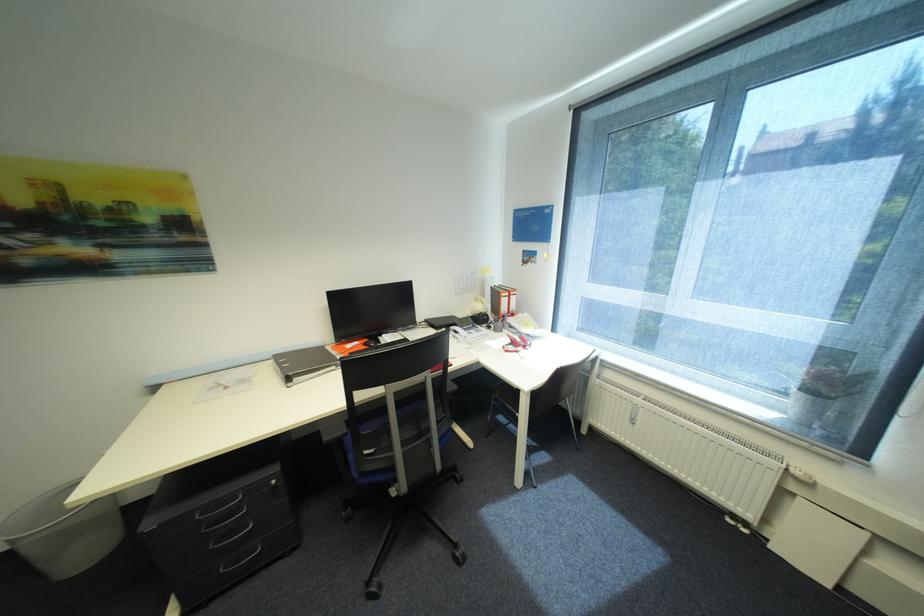
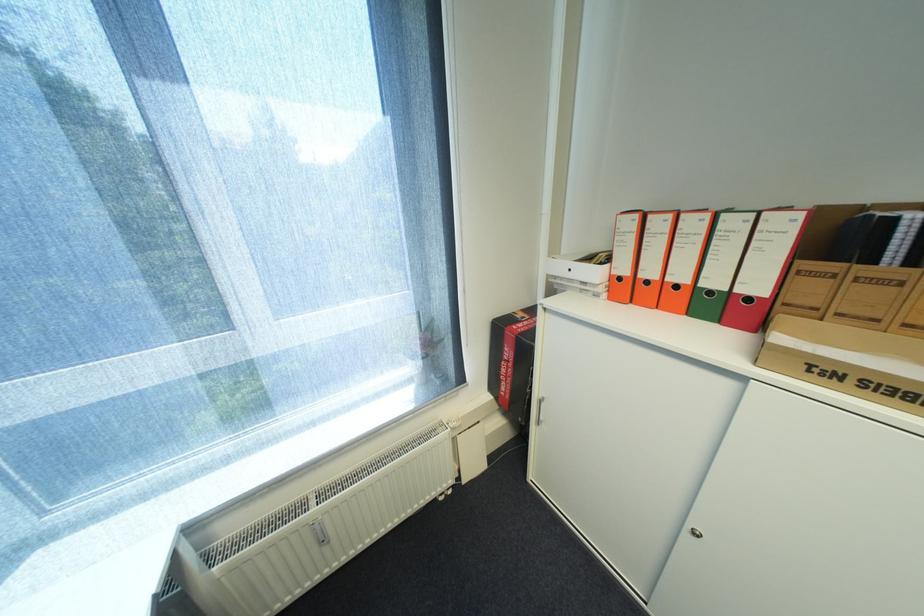
The first image is from the beginning of the video and the second image is from the end. How did the camera likely rotate when shooting the video?

The camera's rotation is toward right-down.